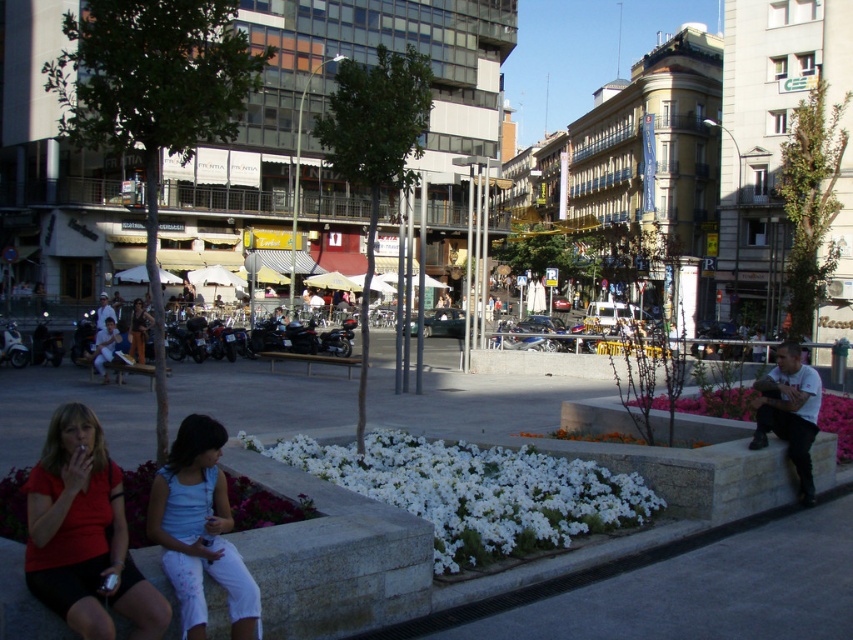
Is point (51, 556) positioned after point (213, 428)?

No, it is in front of (213, 428).

Which is more to the left, matte red shirt at lower left or light blue fabric pants at lower center?

matte red shirt at lower left is more to the left.

Who is more distant from viewer, (80, 515) or (189, 636)?

The point (189, 636) is more distant.

I want to click on matte red shirt at lower left, so click(x=84, y=534).

Does white stone flower bed at center have a lesser width compared to pink fabric flower at lower right?

Incorrect, white stone flower bed at center's width is not less than pink fabric flower at lower right's.

Can you confirm if white stone flower bed at center is bigger than pink fabric flower at lower right?

Correct, white stone flower bed at center is larger in size than pink fabric flower at lower right.

You are a GUI agent. You are given a task and a screenshot of the screen. Output one action in this format:
    pyautogui.click(x=<x>, y=<y>)
    Task: Click on the white stone flower bed at center
    
    Given the screenshot: What is the action you would take?
    pyautogui.click(x=476, y=492)

Is point (809, 408) less distant than point (149, 369)?

Yes, point (809, 408) is closer to viewer.

Is white cotton shirt at lower right to the right of light blue denim jeans at center from the viewer's perspective?

Yes, white cotton shirt at lower right is to the right of light blue denim jeans at center.

This screenshot has height=640, width=853. Find the location of `white cotton shirt at lower right`. white cotton shirt at lower right is located at coordinates (788, 412).